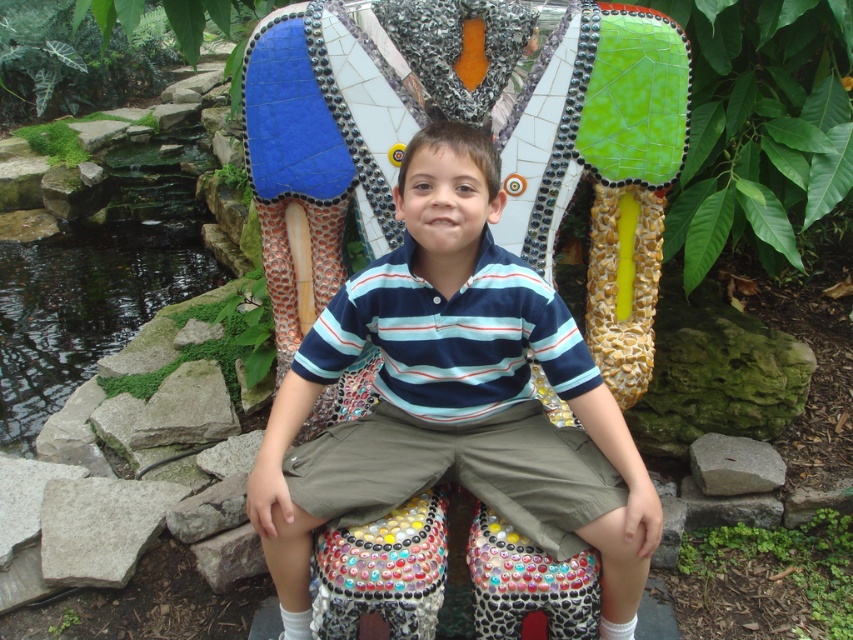
Can you confirm if striped cotton shirt at center is shorter than green mossy rocks at left?

Yes, striped cotton shirt at center is shorter than green mossy rocks at left.

Is striped cotton shirt at center bigger than green mossy rocks at left?

No.

Is point (612, 512) positioned in front of point (84, 275)?

Yes, point (612, 512) is closer to viewer.

Where is `striped cotton shirt at center`? This screenshot has width=853, height=640. striped cotton shirt at center is located at coordinates (454, 396).